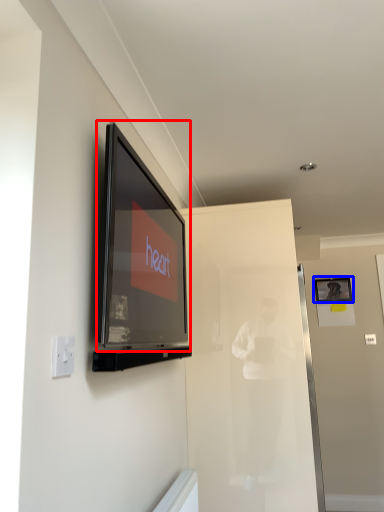
Question: Which point is further to the camera, television (highlighted by a red box) or picture frame (highlighted by a blue box)?

Choices:
 (A) television
 (B) picture frame

Answer: (B)